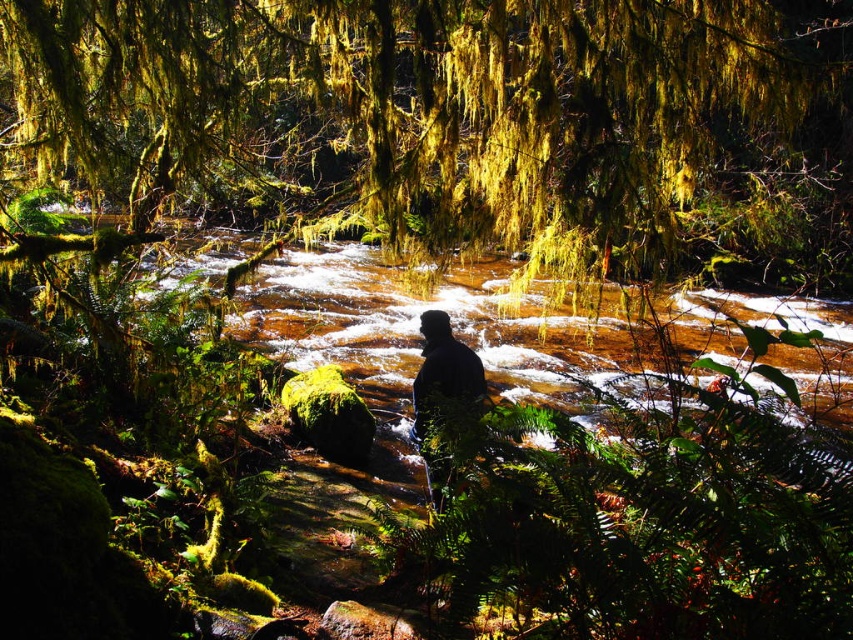
Between green mossy tree at center and black matte person at center, which one has more height?

green mossy tree at center is taller.

Does green mossy tree at center appear over black matte person at center?

Yes, green mossy tree at center is above black matte person at center.

You are a GUI agent. You are given a task and a screenshot of the screen. Output one action in this format:
    pyautogui.click(x=<x>, y=<y>)
    Task: Click on the green mossy tree at center
    The height and width of the screenshot is (640, 853).
    Given the screenshot: What is the action you would take?
    pyautogui.click(x=430, y=102)